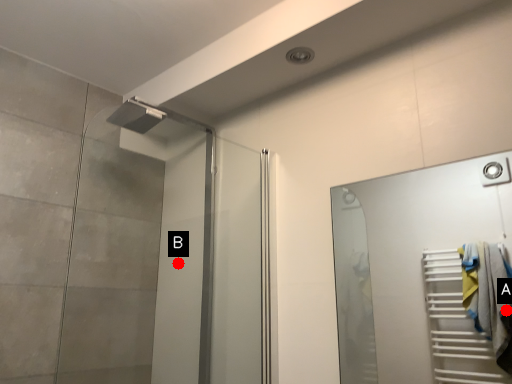
Question: Two points are circled on the image, labeled by A and B beside each circle. Among these points, which one is farthest from the camera?

Choices:
 (A) A is further
 (B) B is further

Answer: (A)